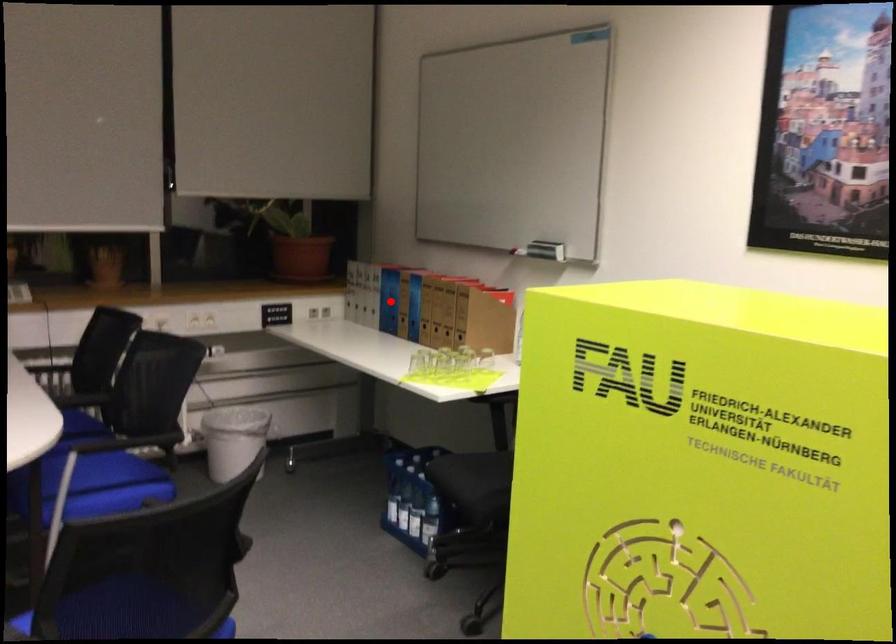
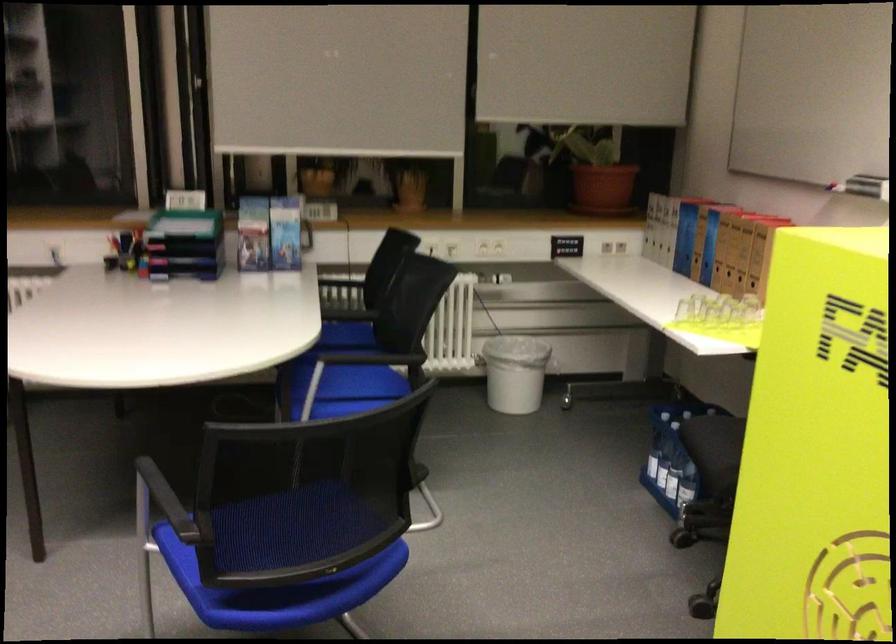
Question: I am providing you with two images of the same scene from different viewpoints. Given a red point in image1, look at the same physical point in image2. Is it:

Choices:
 (A) Closer to the viewpoint
 (B) Farther from the viewpoint

Answer: (A)